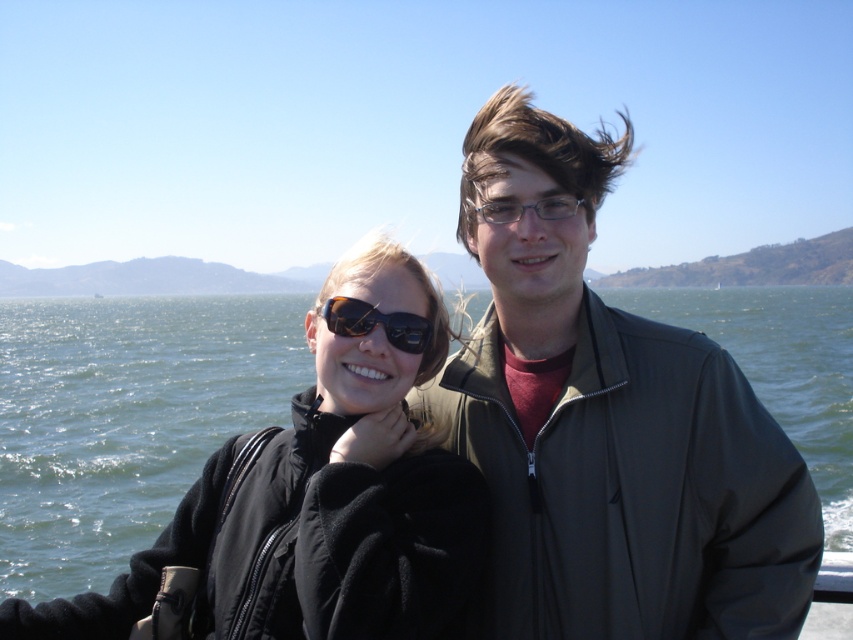
Question: Among these objects, which one is farthest from the camera?

Choices:
 (A) green water at center
 (B) dark gray jacket at center
 (C) matte black sunglasses at center

Answer: (A)

Question: Is dark gray jacket at center thinner than matte black sunglasses at center?

Choices:
 (A) no
 (B) yes

Answer: (A)

Question: Where is dark gray jacket at center located in relation to matte black sunglasses at center in the image?

Choices:
 (A) below
 (B) above

Answer: (B)

Question: Considering the real-world distances, which object is farthest from the green water at center?

Choices:
 (A) matte black sunglasses at center
 (B) dark gray jacket at center

Answer: (B)

Question: Which point is farther from the camera taking this photo?

Choices:
 (A) (577, 438)
 (B) (112, 358)

Answer: (B)

Question: Is dark gray jacket at center thinner than green water at center?

Choices:
 (A) no
 (B) yes

Answer: (B)